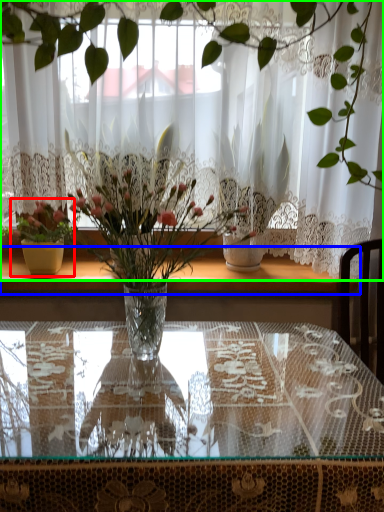
Question: Which is nearer to the houseplant (highlighted by a red box)? window sill (highlighted by a blue box) or curtain (highlighted by a green box).

Choices:
 (A) window sill
 (B) curtain

Answer: (A)